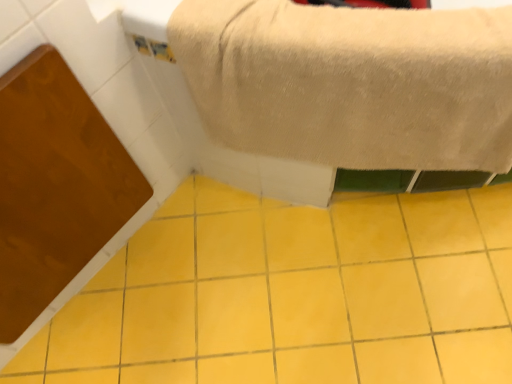
Question: Is yellow ceramic tile at center positioned behind beige plush towel at upper center?

Choices:
 (A) no
 (B) yes

Answer: (B)

Question: Is yellow ceramic tile at center bigger than beige plush towel at upper center?

Choices:
 (A) no
 (B) yes

Answer: (A)

Question: Can you confirm if yellow ceramic tile at center is smaller than beige plush towel at upper center?

Choices:
 (A) no
 (B) yes

Answer: (B)

Question: From the image's perspective, is yellow ceramic tile at center beneath beige plush towel at upper center?

Choices:
 (A) no
 (B) yes

Answer: (B)

Question: Is yellow ceramic tile at center surrounding beige plush towel at upper center?

Choices:
 (A) no
 (B) yes

Answer: (A)

Question: Does yellow ceramic tile at center have a greater width compared to beige plush towel at upper center?

Choices:
 (A) yes
 (B) no

Answer: (A)

Question: Is beige plush towel at upper center positioned with its back to yellow ceramic tile at center?

Choices:
 (A) yes
 (B) no

Answer: (B)

Question: Can you confirm if beige plush towel at upper center is taller than yellow ceramic tile at center?

Choices:
 (A) yes
 (B) no

Answer: (A)

Question: Considering the relative sizes of beige plush towel at upper center and yellow ceramic tile at center in the image provided, is beige plush towel at upper center smaller than yellow ceramic tile at center?

Choices:
 (A) no
 (B) yes

Answer: (A)

Question: Does beige plush towel at upper center come in front of yellow ceramic tile at center?

Choices:
 (A) no
 (B) yes

Answer: (B)

Question: Does beige plush towel at upper center appear on the left side of yellow ceramic tile at center?

Choices:
 (A) no
 (B) yes

Answer: (A)

Question: Can you confirm if beige plush towel at upper center is wider than yellow ceramic tile at center?

Choices:
 (A) no
 (B) yes

Answer: (A)

Question: Looking at their shapes, would you say beige plush towel at upper center is wider or thinner than yellow ceramic tile at center?

Choices:
 (A) thin
 (B) wide

Answer: (A)